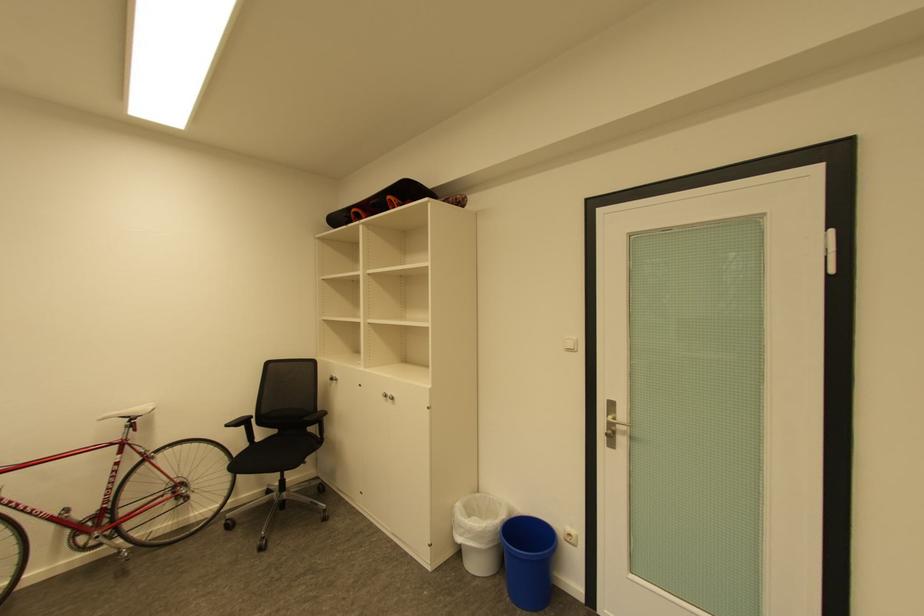
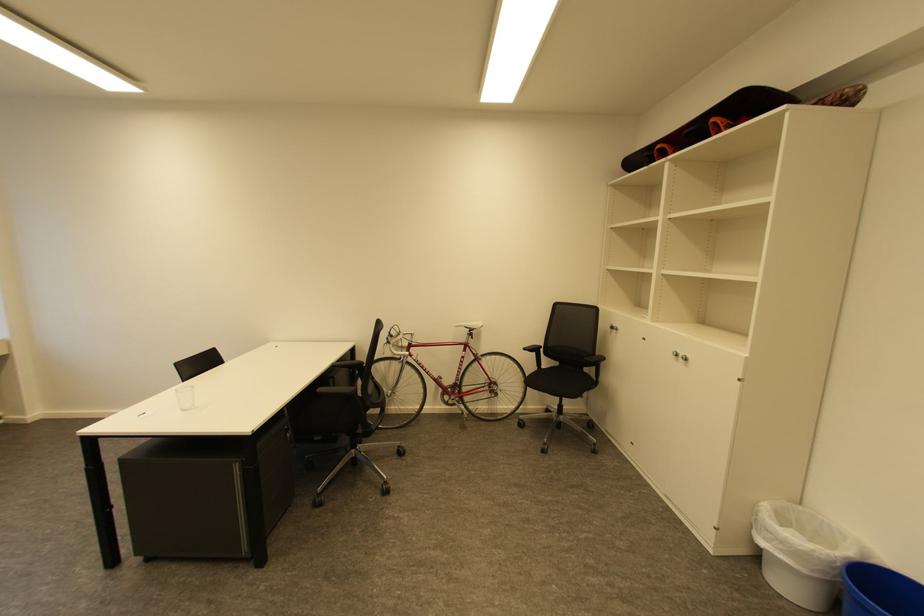
Locate, in the second image, the point that corresponds to point (235, 426) in the first image.

(531, 350)